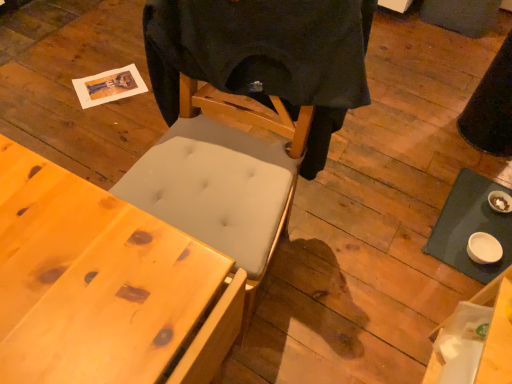
Locate an element on the screen. The width and height of the screenshot is (512, 384). blank space above white matte table at lower right (from a real-world perspective) is located at coordinates (476, 230).